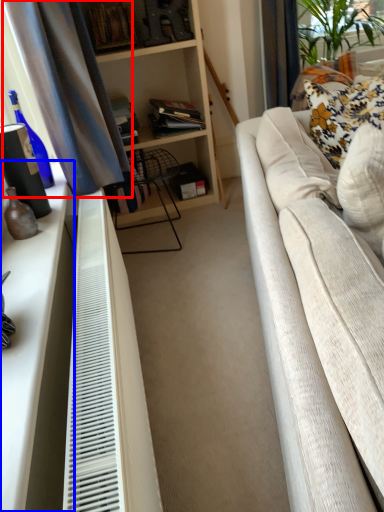
Question: Which object appears closest to the camera in this image, curtain (highlighted by a red box) or dresser (highlighted by a blue box)?

Choices:
 (A) curtain
 (B) dresser

Answer: (B)